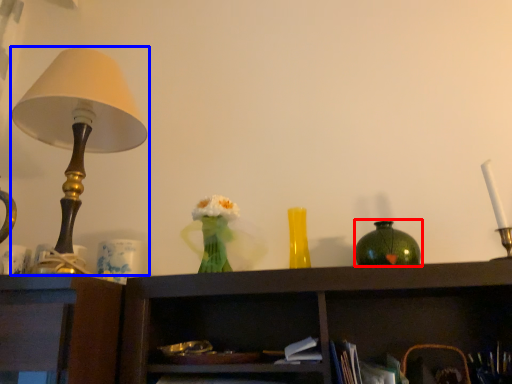
Question: Which of the following is the closest to the observer, vase (highlighted by a red box) or lamp (highlighted by a blue box)?

Choices:
 (A) vase
 (B) lamp

Answer: (B)